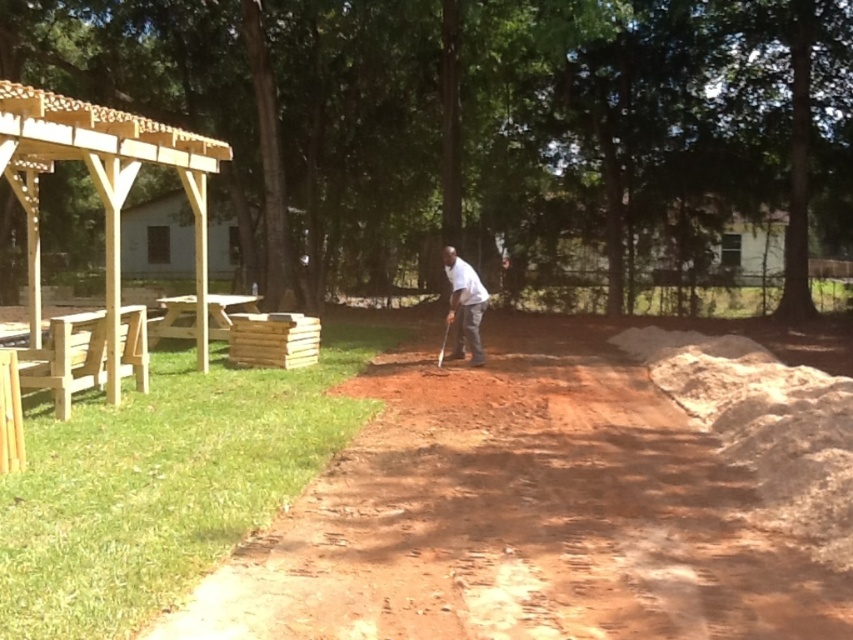
Question: Estimate the real-world distances between objects in this image. Which object is farther from the brown wooden picnic table at left?

Choices:
 (A) white matte shirt at center
 (B) brown dirt field at center

Answer: (A)

Question: In this image, where is natural wood pergola at upper left located relative to brown wooden picnic table at left?

Choices:
 (A) below
 (B) above

Answer: (B)

Question: Does brown dirt field at center appear on the right side of white matte shirt at center?

Choices:
 (A) yes
 (B) no

Answer: (A)

Question: Which object is positioned closest to the light brown wooden picnic table at left?

Choices:
 (A) natural wood pergola at upper left
 (B) white matte shirt at center

Answer: (A)

Question: Which object is the closest to the brown wooden picnic table at left?

Choices:
 (A) natural wood pergola at upper left
 (B) white matte shirt at center
 (C) brown dirt field at center
 (D) light brown wooden picnic table at left

Answer: (A)

Question: Is white matte shirt at center above light brown wooden picnic table at left?

Choices:
 (A) yes
 (B) no

Answer: (A)